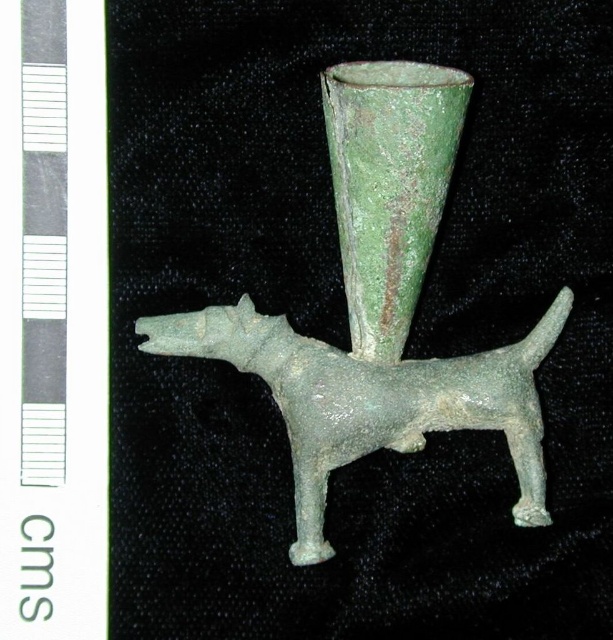
Looking at this image, you are a curator standing 1.2 meters tall. You want to view the green patinated metal dog at center from a position where the top of the dog is at eye level. Given that the dog is 1.31 meters away from you, is this possible?

The distance between the green patinated metal dog at center and the viewer is 1.31 meters. Since the curator is 1.2 meters tall, they can adjust their position or angle to align their eye level with the top of the dog by tilting their head upwards or moving closer, but the given distance is fixed. However, without additional information about the dog sculpture height, it is impossible to determine if the top of the dog is within the curator eye level range.

You are an archaeologist examining the artifact. The green patinated metal dog at center and the green patinated glass vase at center are part of the same piece. Which object is taller?

The green patinated glass vase at center is taller than the green patinated metal dog at center.

You are an archaeologist examining the artifact. You need to determine the spatial relationship between the green patinated metal dog at center and the green patinated glass vase at center. Which object is positioned lower in the scene?

The green patinated metal dog at center is positioned below the green patinated glass vase at center, so it is lower in the scene.